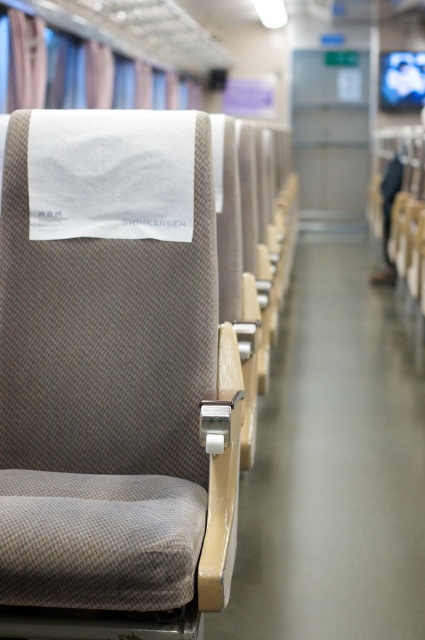
Question: Is textured beige seat at center positioned behind blue fabric curtain at upper left?

Choices:
 (A) no
 (B) yes

Answer: (A)

Question: Is textured beige seat at center positioned at the back of blue fabric curtain at upper left?

Choices:
 (A) no
 (B) yes

Answer: (A)

Question: Is textured beige seat at center further to the viewer compared to blue fabric curtain at upper left?

Choices:
 (A) no
 (B) yes

Answer: (A)